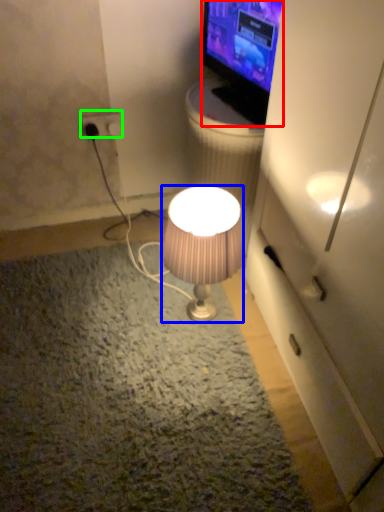
Question: Estimate the real-world distances between objects in this image. Which object is closer to television (highlighted by a red box), lamp (highlighted by a blue box) or power outlet (highlighted by a green box)?

Choices:
 (A) lamp
 (B) power outlet

Answer: (A)